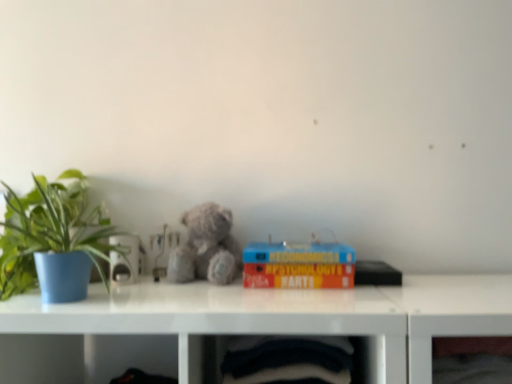
Question: Is velvet-like black fabric at lower center, which is the first shelf in left-to-right order, at the right side of fuzzy gray teddy bear at center?

Choices:
 (A) no
 (B) yes

Answer: (B)

Question: Is velvet-like black fabric at lower center, which is the first shelf in left-to-right order, in front of fuzzy gray teddy bear at center?

Choices:
 (A) yes
 (B) no

Answer: (A)

Question: From the image's perspective, would you say velvet-like black fabric at lower center, which is the second shelf in right-to-left order, is positioned over fuzzy gray teddy bear at center?

Choices:
 (A) no
 (B) yes

Answer: (A)

Question: Does velvet-like black fabric at lower center, which is the second shelf in right-to-left order, come behind fuzzy gray teddy bear at center?

Choices:
 (A) no
 (B) yes

Answer: (A)

Question: Can you confirm if velvet-like black fabric at lower center, which is the second shelf in right-to-left order, is bigger than fuzzy gray teddy bear at center?

Choices:
 (A) yes
 (B) no

Answer: (A)

Question: Is velvet-like black fabric at lower center, which is the second shelf in right-to-left order, in contact with fuzzy gray teddy bear at center?

Choices:
 (A) no
 (B) yes

Answer: (A)

Question: From the image's perspective, is transparent glass frame at lower right, the 1th shelf when ordered from right to left, above green matte plant at left?

Choices:
 (A) no
 (B) yes

Answer: (A)

Question: Is transparent glass frame at lower right, the 1th shelf when ordered from right to left, not inside green matte plant at left?

Choices:
 (A) no
 (B) yes

Answer: (B)

Question: Is transparent glass frame at lower right, the 1th shelf when ordered from right to left, aimed at green matte plant at left?

Choices:
 (A) no
 (B) yes

Answer: (A)

Question: Is the surface of transparent glass frame at lower right, the 1th shelf when ordered from right to left, in direct contact with green matte plant at left?

Choices:
 (A) yes
 (B) no

Answer: (B)

Question: Does transparent glass frame at lower right, the 1th shelf when ordered from right to left, have a greater width compared to green matte plant at left?

Choices:
 (A) no
 (B) yes

Answer: (A)

Question: Is transparent glass frame at lower right, which is the second shelf in left-to-right order, in front of green matte plant at left?

Choices:
 (A) yes
 (B) no

Answer: (A)

Question: Is hardcover book at center at the back of fuzzy gray teddy bear at center?

Choices:
 (A) no
 (B) yes

Answer: (A)